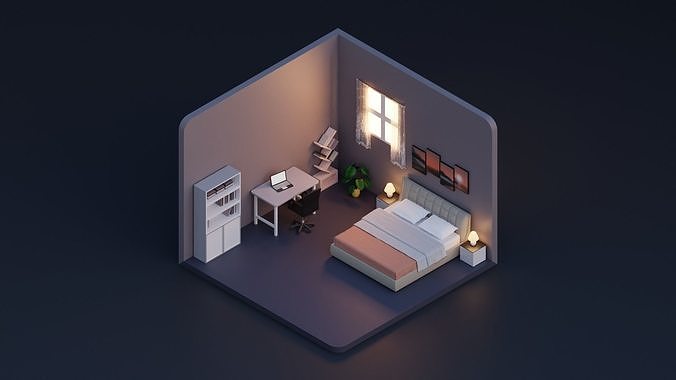
This screenshot has width=676, height=380. What are the coordinates of `lamp` in the screenshot? It's located at (387, 190).